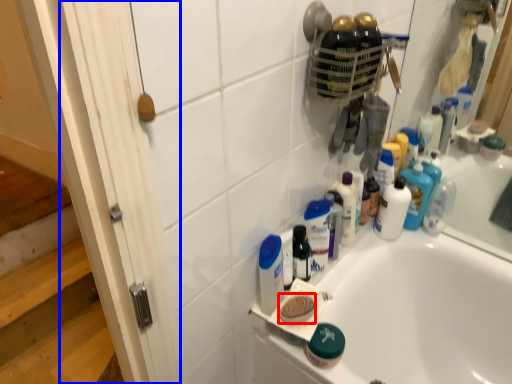
Question: Which object appears farthest to the camera in this image, soap (highlighted by a red box) or screen door (highlighted by a blue box)?

Choices:
 (A) soap
 (B) screen door

Answer: (A)